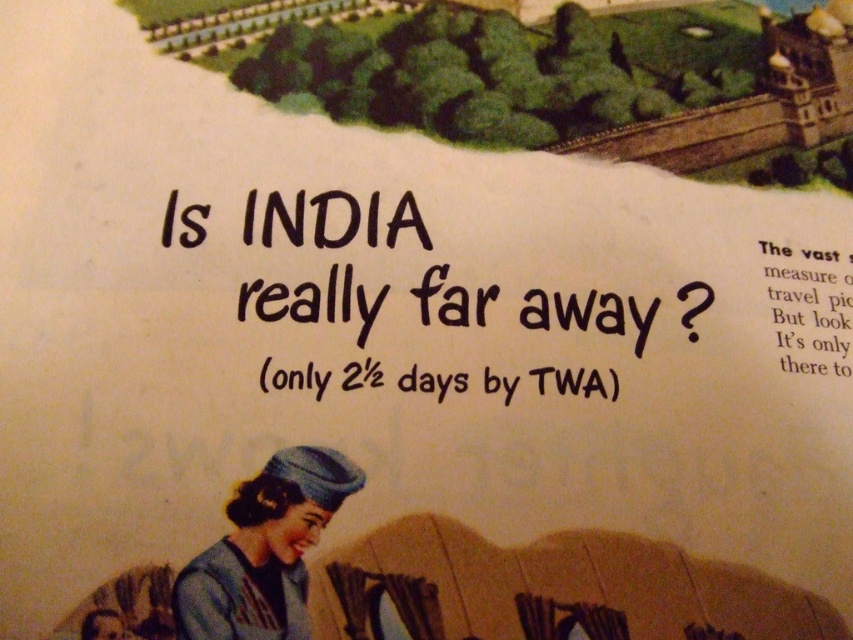
Is matte blue hat at lower left to the left of black paper text at upper right from the viewer's perspective?

Yes, matte blue hat at lower left is to the left of black paper text at upper right.

Who is higher up, matte blue hat at lower left or black paper text at upper right?

black paper text at upper right

You are a GUI agent. You are given a task and a screenshot of the screen. Output one action in this format:
    pyautogui.click(x=<x>, y=<y>)
    Task: Click on the matte blue hat at lower left
    The width and height of the screenshot is (853, 640).
    Given the screenshot: What is the action you would take?
    pyautogui.click(x=264, y=548)

You are a GUI agent. You are given a task and a screenshot of the screen. Output one action in this format:
    pyautogui.click(x=<x>, y=<y>)
    Task: Click on the matte blue hat at lower left
    This screenshot has width=853, height=640.
    Given the screenshot: What is the action you would take?
    pyautogui.click(x=264, y=548)

Can you confirm if black ink text at center is positioned to the right of black paper text at upper right?

No, black ink text at center is not to the right of black paper text at upper right.

Is point (334, 211) closer to camera compared to point (807, 324)?

Yes, it is in front of point (807, 324).

What are the coordinates of `black ink text at center` in the screenshot? It's located at (314, 301).

Does black ink text at center have a smaller size compared to matte blue hat at lower left?

Incorrect, black ink text at center is not smaller in size than matte blue hat at lower left.

Can you confirm if black ink text at center is positioned to the left of matte blue hat at lower left?

Incorrect, black ink text at center is not on the left side of matte blue hat at lower left.

Is point (527, 305) behind point (361, 483)?

Yes.

Locate an element on the screen. black ink text at center is located at coordinates (314, 301).